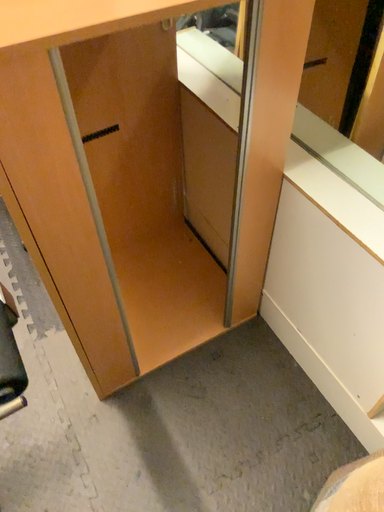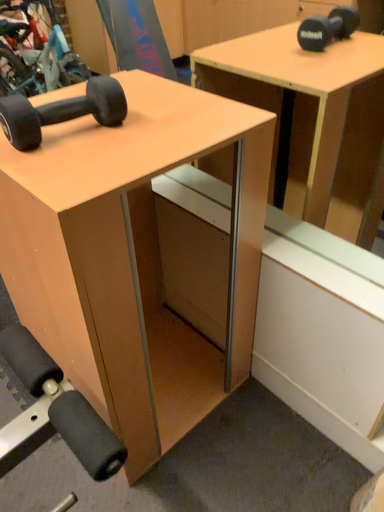
Question: How did the camera likely rotate when shooting the video?

Choices:
 (A) rotated left
 (B) rotated right

Answer: (B)